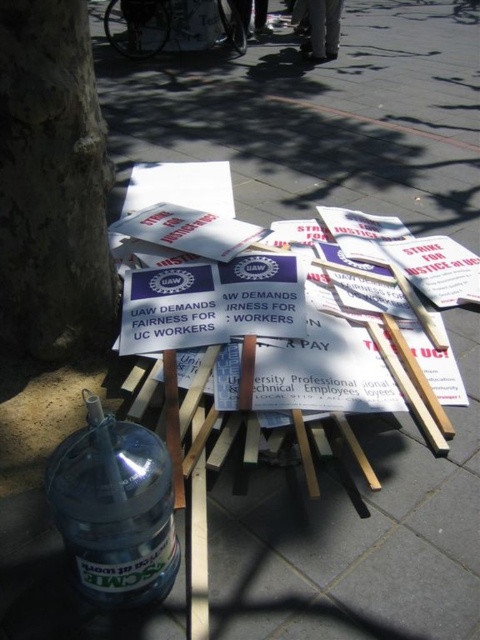
Is smooth bark tree at lower left bigger than clear plastic bottle at lower left?

Correct, smooth bark tree at lower left is larger in size than clear plastic bottle at lower left.

From the picture: Is smooth bark tree at lower left shorter than clear plastic bottle at lower left?

Incorrect, smooth bark tree at lower left's height does not fall short of clear plastic bottle at lower left's.

Is point (3, 204) closer to camera compared to point (93, 500)?

No, (3, 204) is further to viewer.

At what (x,y) coordinates should I click in order to perform the action: click on smooth bark tree at lower left. Please return your answer as a coordinate pair (x, y). The image size is (480, 640). Looking at the image, I should click on (52, 182).